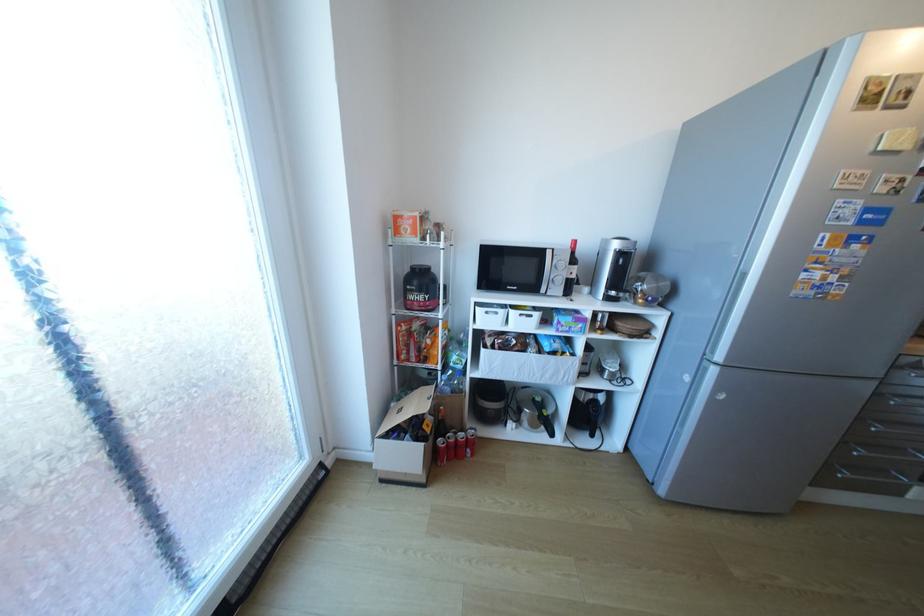
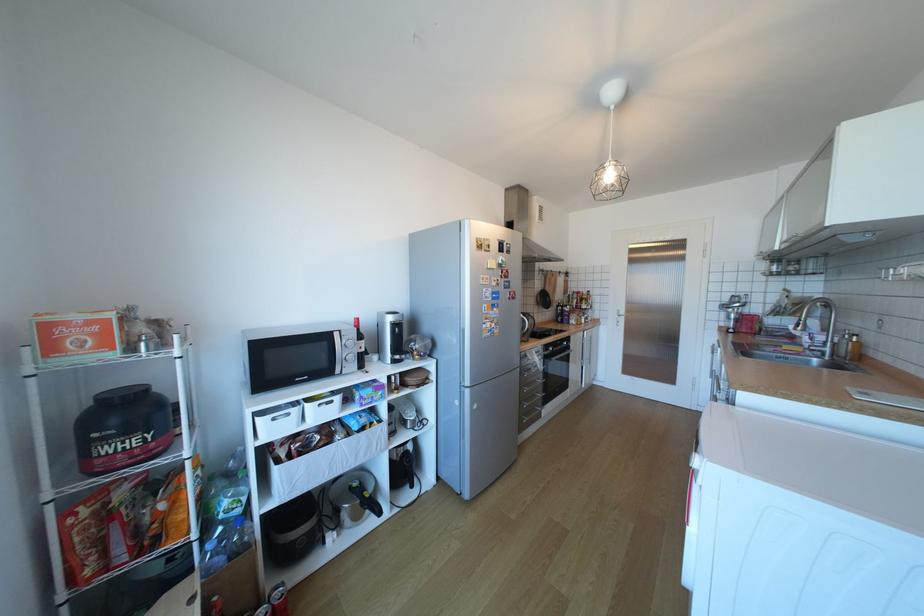
Find the pixel in the second image that matches pixel 477 438 in the first image.

(283, 607)